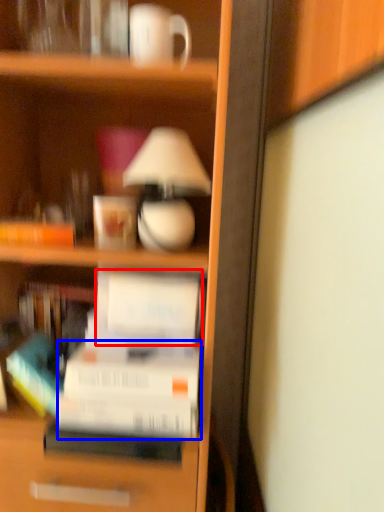
Question: Among these objects, which one is nearest to the camera, paperback book (highlighted by a red box) or paperback book (highlighted by a blue box)?

Choices:
 (A) paperback book
 (B) paperback book

Answer: (B)